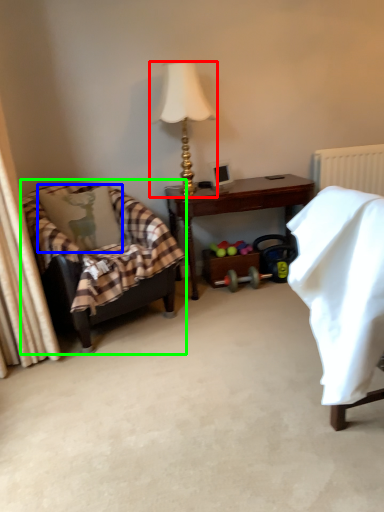
Question: Which is nearer to the lamp (highlighted by a red box)? pillow (highlighted by a blue box) or chair (highlighted by a green box).

Choices:
 (A) pillow
 (B) chair

Answer: (A)